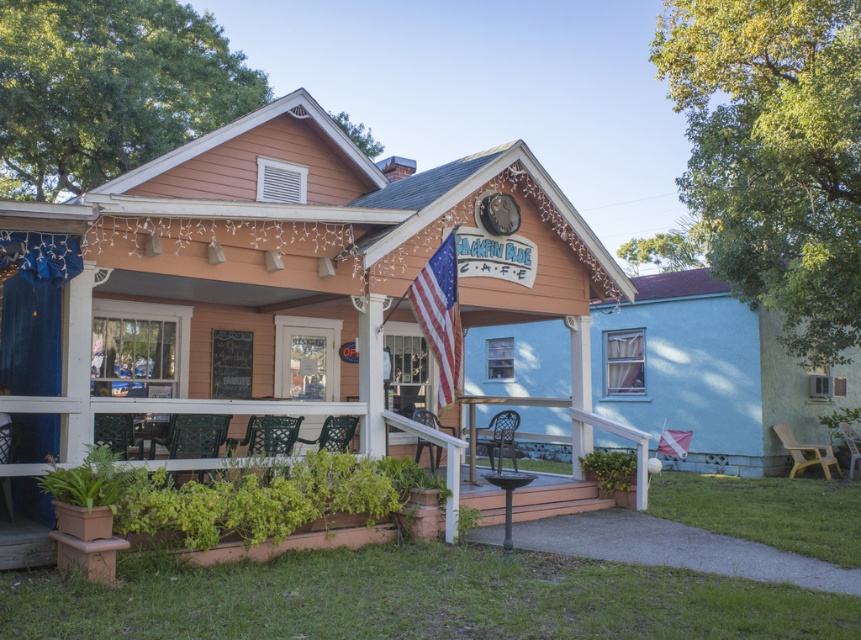
Can you confirm if terracotta pot at lower left is wider than american flag at center?

Indeed, terracotta pot at lower left has a greater width compared to american flag at center.

Image resolution: width=861 pixels, height=640 pixels. What are the coordinates of `terracotta pot at lower left` in the screenshot? It's located at (191, 404).

Where is `terracotta pot at lower left`? This screenshot has width=861, height=640. terracotta pot at lower left is located at coordinates (191, 404).

Is american flag at center taller than white fabric flag at center?

Correct, american flag at center is much taller as white fabric flag at center.

Who is higher up, american flag at center or white fabric flag at center?

american flag at center is above.

Is point (443, 353) closer to camera compared to point (669, 442)?

Yes, it is.

Where is `american flag at center`? The width and height of the screenshot is (861, 640). american flag at center is located at coordinates (440, 316).

Is point (159, 401) behind point (669, 436)?

No, (159, 401) is in front of (669, 436).

Where is `terracotta pot at lower left`? The image size is (861, 640). terracotta pot at lower left is located at coordinates (191, 404).